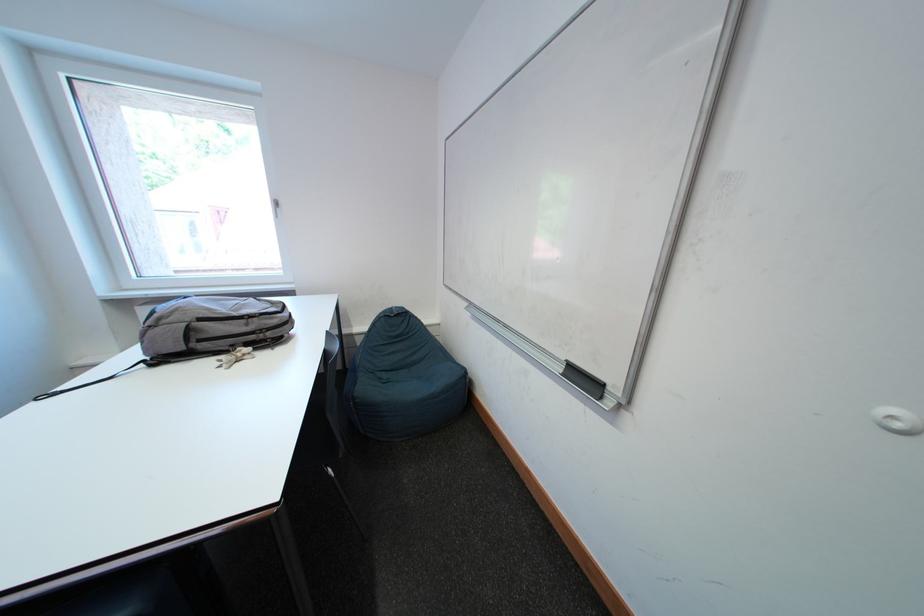
At what (x,y) coordinates should I click in order to perform the action: click on set of keys. Please return your answer as a coordinate pair (x, y). Looking at the image, I should click on (235, 357).